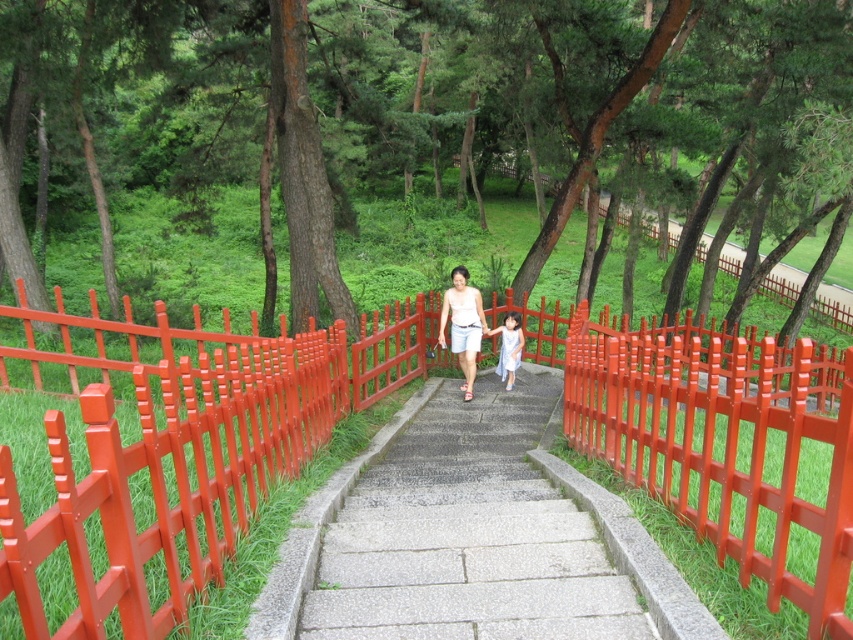
You are standing at the bottom of the gray concrete stairs at center and want to place a small potted plant between the red plastic fence at center and the stairs. Based on their positions, can you tell me which object you need to move closer to the front to make space?

The red plastic fence at center is closer to the viewer than the gray concrete stairs at center, so you need to move the red plastic fence at center forward to create space between them.

You are standing at the bottom of the staircase and see the point marked at coordinates (729, 448). Based on the scene description, what object is located at that point?

The point at coordinates (729, 448) indicates the red plastic fence at center.